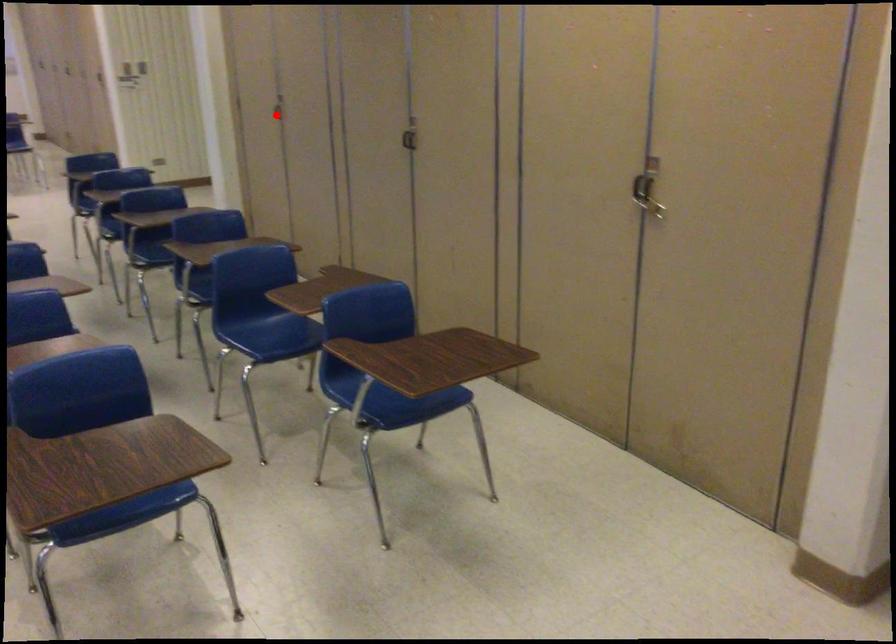
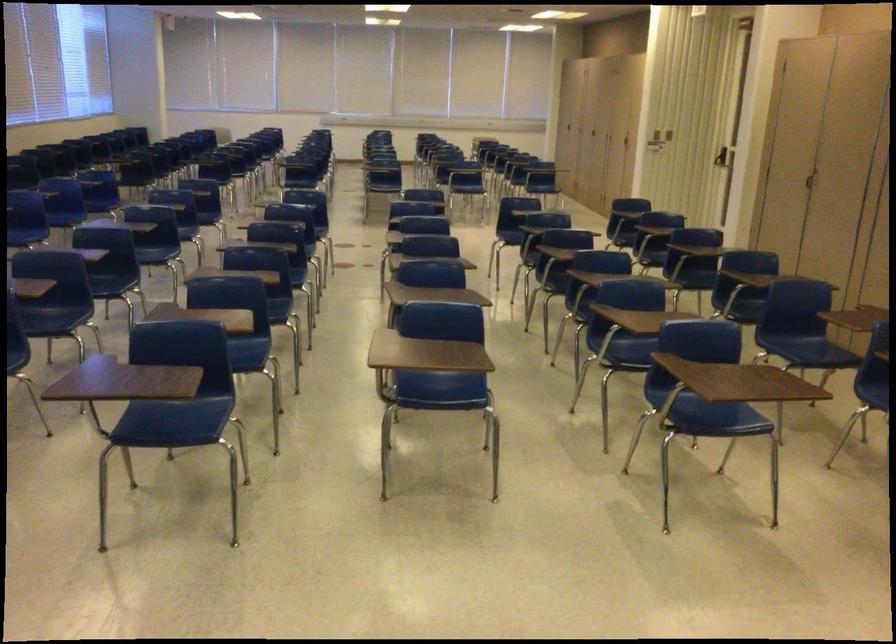
The point at the highlighted location is marked in the first image. Where is the corresponding point in the second image?

(808, 180)